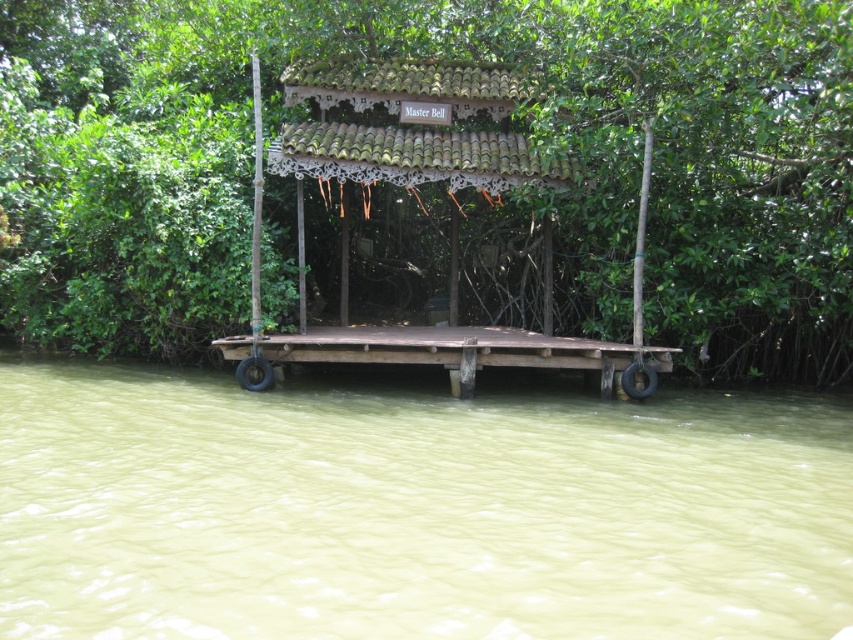
Between green murky water at lower center and brown wooden gazebo at center, which one has less height?

With less height is green murky water at lower center.

Looking at this image, can you confirm if green murky water at lower center is wider than brown wooden gazebo at center?

Indeed, green murky water at lower center has a greater width compared to brown wooden gazebo at center.

Between point (158, 556) and point (413, 355), which one is positioned in front?

Point (158, 556) is more forward.

Find the location of a particular element. green murky water at lower center is located at coordinates pos(413,512).

Which of these two, green leafy tree at center or brown wooden gazebo at center, stands shorter?

brown wooden gazebo at center

Does green leafy tree at center come behind brown wooden gazebo at center?

No, green leafy tree at center is in front of brown wooden gazebo at center.

The image size is (853, 640). What do you see at coordinates (436, 170) in the screenshot?
I see `green leafy tree at center` at bounding box center [436, 170].

Locate an element on the screen. green leafy tree at center is located at coordinates pos(436,170).

Does green murky water at lower center appear on the right side of brown wooden dock at center?

Incorrect, green murky water at lower center is not on the right side of brown wooden dock at center.

Which is behind, point (753, 413) or point (242, 342)?

The point (753, 413) is behind.

This screenshot has width=853, height=640. I want to click on green murky water at lower center, so click(x=413, y=512).